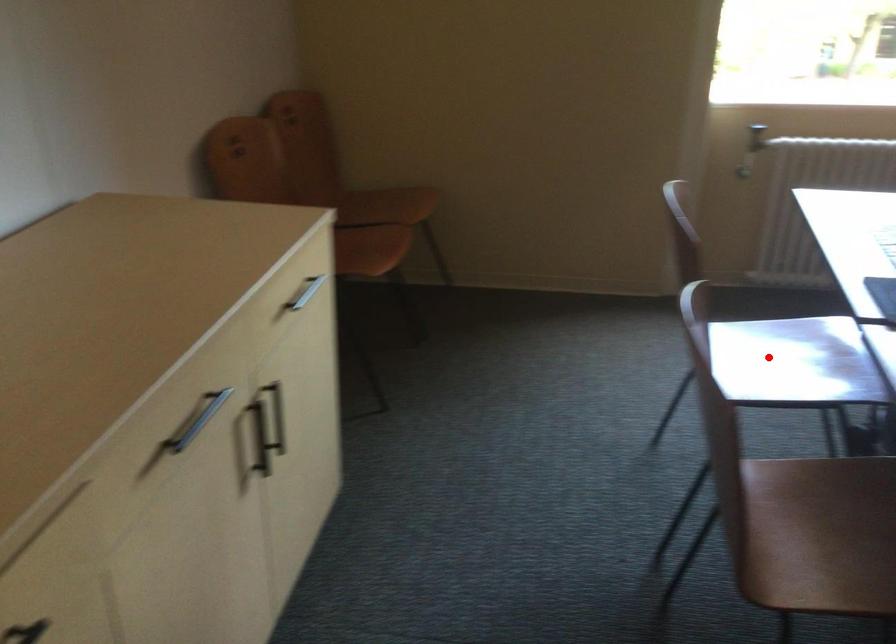
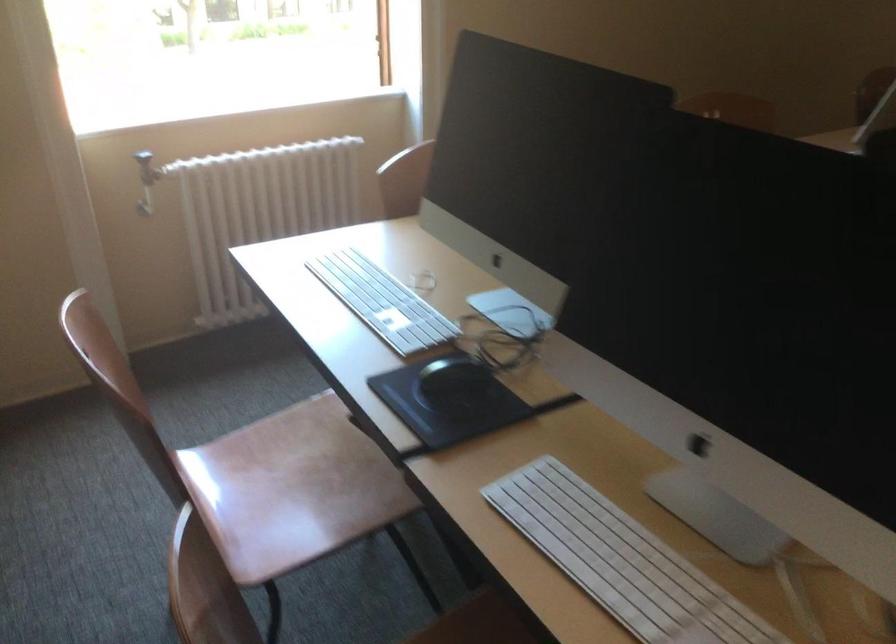
Where in the second image is the point corresponding to the highlighted location from the first image?

(291, 488)